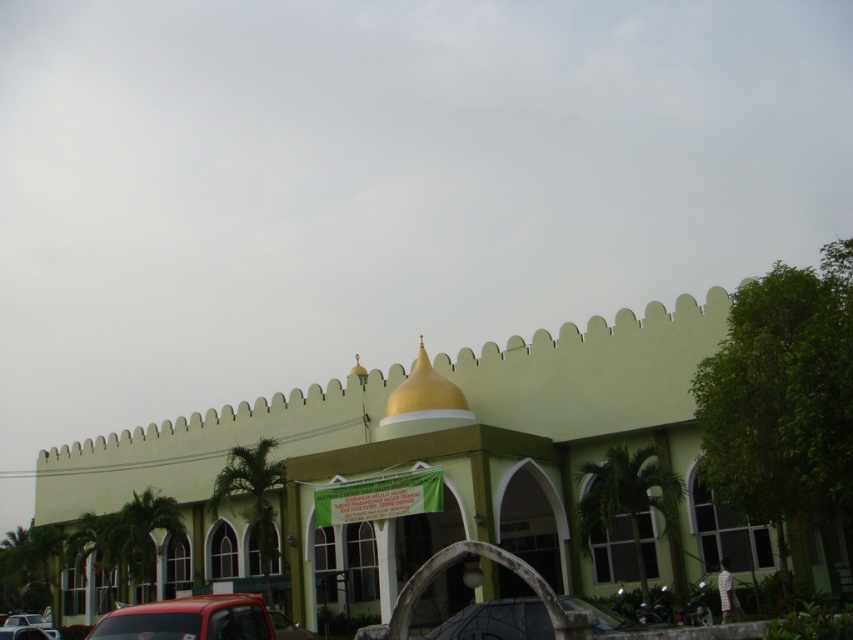
Describe the element at coordinates (437, 467) in the screenshot. The height and width of the screenshot is (640, 853). I see `green matte building at center` at that location.

Which is below, green matte building at center or metallic red car at lower left?

metallic red car at lower left

Image resolution: width=853 pixels, height=640 pixels. I want to click on green matte building at center, so click(x=437, y=467).

You are a GUI agent. You are given a task and a screenshot of the screen. Output one action in this format:
    pyautogui.click(x=<x>, y=<y>)
    Task: Click on the green matte building at center
    
    Given the screenshot: What is the action you would take?
    pyautogui.click(x=437, y=467)

Which is below, metallic red truck at lower left or metallic red car at lower left?

metallic red car at lower left is below.

Find the location of a particular element. metallic red truck at lower left is located at coordinates (189, 620).

Does point (184, 627) come in front of point (38, 621)?

Yes, point (184, 627) is closer to viewer.

Locate an element on the screen. The width and height of the screenshot is (853, 640). metallic red truck at lower left is located at coordinates click(x=189, y=620).

Does metallic silver car at lower center appear over metallic red car at lower left?

Yes, metallic silver car at lower center is above metallic red car at lower left.

Can you confirm if metallic silver car at lower center is positioned to the left of metallic red car at lower left?

Incorrect, metallic silver car at lower center is not on the left side of metallic red car at lower left.

The image size is (853, 640). I want to click on metallic silver car at lower center, so click(496, 621).